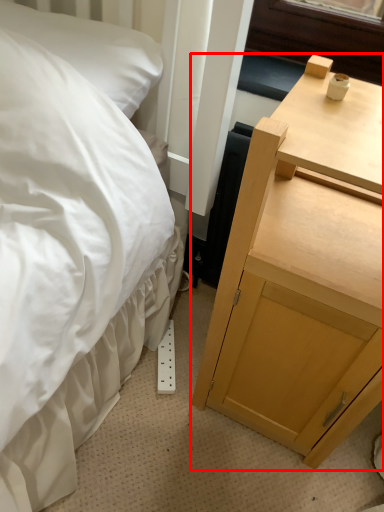
Question: From the image's perspective, what is the correct spatial relationship of nightstand (annotated by the red box) in relation to pillow?

Choices:
 (A) above
 (B) below

Answer: (B)